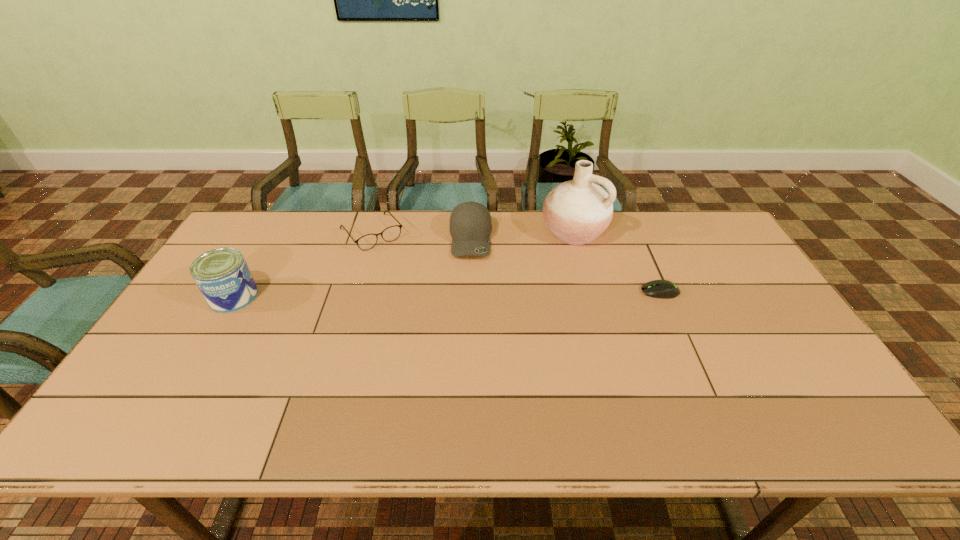
The image size is (960, 540). Find the location of `the leftmost object`. the leftmost object is located at coordinates (222, 275).

Locate an element on the screen. Image resolution: width=960 pixels, height=540 pixels. computer mouse is located at coordinates (663, 289).

Where is `the rightmost object`? The height and width of the screenshot is (540, 960). the rightmost object is located at coordinates [x=663, y=289].

The height and width of the screenshot is (540, 960). What are the coordinates of `baseball cap` in the screenshot? It's located at (470, 224).

Where is `the fourth object from right to left`? The height and width of the screenshot is (540, 960). the fourth object from right to left is located at coordinates (366, 242).

At what (x,y) coordinates should I click in order to perform the action: click on spectacles. Please return your answer as a coordinate pair (x, y). Looking at the image, I should click on (366, 242).

What are the coordinates of `the second object from right to left` in the screenshot? It's located at (578, 211).

Identify the location of the tallest object. (578, 211).

At what (x,y) coordinates should I click in order to perform the action: click on free space located on the front label of the can. Please return your answer as a coordinate pair (x, y). Looking at the image, I should click on (201, 354).

Where is `vacant space situated 0.210m on the wheel side of the rightmost object`? vacant space situated 0.210m on the wheel side of the rightmost object is located at coordinates (569, 292).